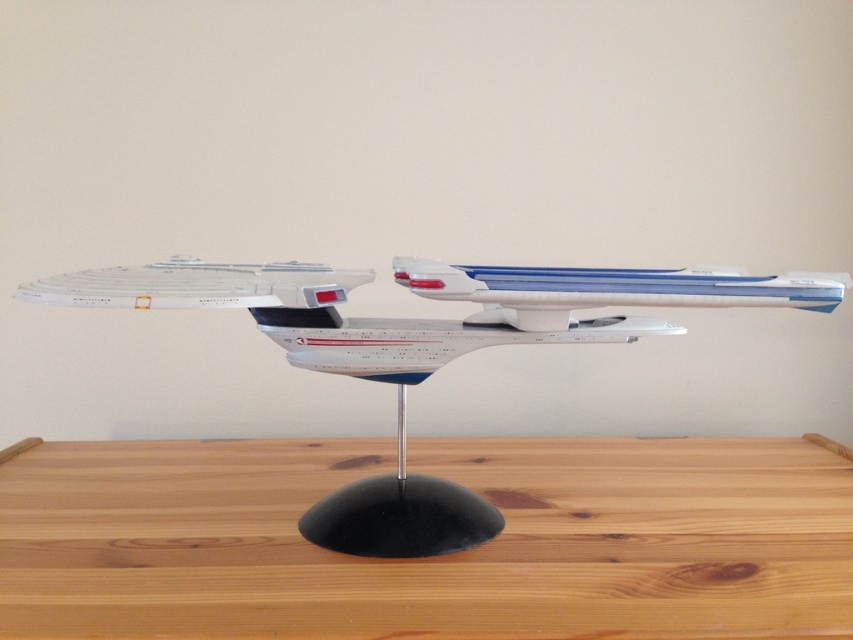
Can you confirm if light brown wood table at center is taller than white plastic airplane at center?

Correct, light brown wood table at center is much taller as white plastic airplane at center.

Can you confirm if light brown wood table at center is wider than white plastic airplane at center?

Yes.

Who is more distant from viewer, (621, 564) or (759, 300)?

The point (621, 564) is more distant.

The image size is (853, 640). I want to click on light brown wood table at center, so click(430, 557).

Does light brown wood table at center have a lesser width compared to white plastic starship at center?

In fact, light brown wood table at center might be wider than white plastic starship at center.

I want to click on light brown wood table at center, so click(430, 557).

Identify the location of light brown wood table at center. click(x=430, y=557).

Can you confirm if white plastic starship at center is taller than white plastic airplane at center?

Yes, white plastic starship at center is taller than white plastic airplane at center.

Does white plastic starship at center have a smaller size compared to white plastic airplane at center?

Actually, white plastic starship at center might be larger than white plastic airplane at center.

Describe the element at coordinates (422, 352) in the screenshot. I see `white plastic starship at center` at that location.

At what (x,y) coordinates should I click in order to perform the action: click on white plastic starship at center. Please return your answer as a coordinate pair (x, y). Image resolution: width=853 pixels, height=640 pixels. Looking at the image, I should click on (422, 352).